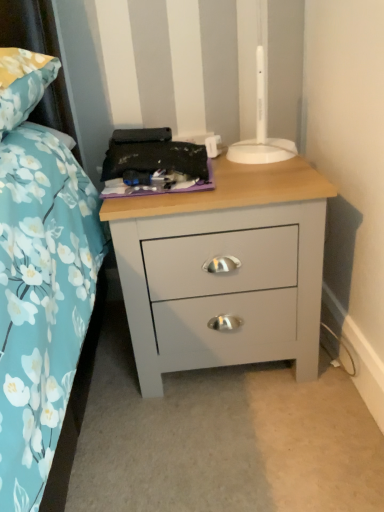
Locate an element on the screen. gray matte/wooden nightstand at center is located at coordinates coord(225,287).

Image resolution: width=384 pixels, height=512 pixels. Describe the element at coordinates (225, 287) in the screenshot. I see `gray matte/wooden nightstand at center` at that location.

Image resolution: width=384 pixels, height=512 pixels. In order to click on gray matte/wooden nightstand at center in this screenshot , I will do `click(225, 287)`.